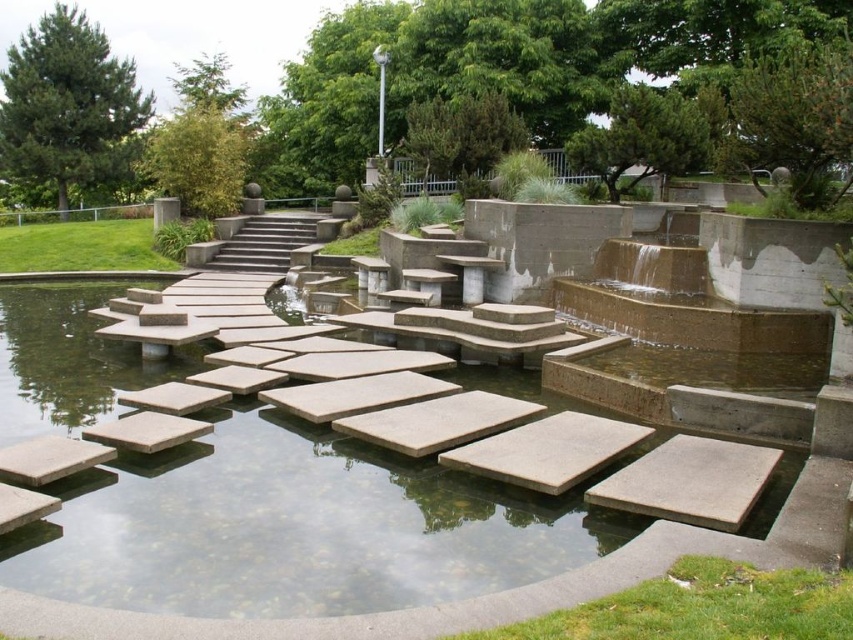
You are standing at the edge of the smooth concrete pond at center and want to reach the concrete stairs at center. Which direction should you move to get closer to the stairs?

Since the smooth concrete pond at center is closer to the viewer than the concrete stairs at center, you should move forward away from the pond towards the stairs to reach them.

You are a maintenance worker needing to inspect the smooth concrete pond at center and the concrete stairs at center. Which one is positioned lower in the scene?

The smooth concrete pond at center is located below the concrete stairs at center, so it is positioned lower.

You are standing at the point marked by the coordinates (299,525) in the image. What object are you most likely standing on?

The point marked by the coordinates (299,525) corresponds to the smooth concrete pond at center.